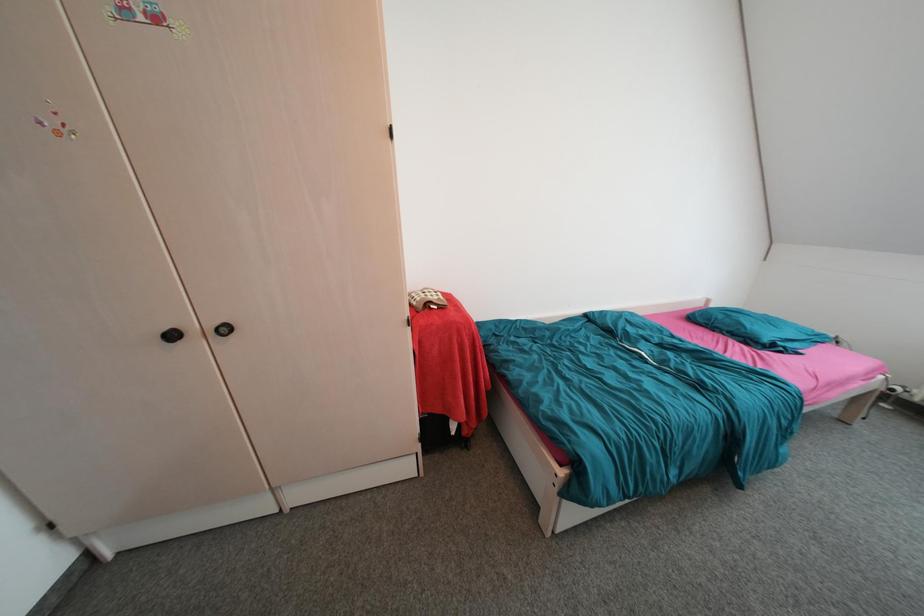
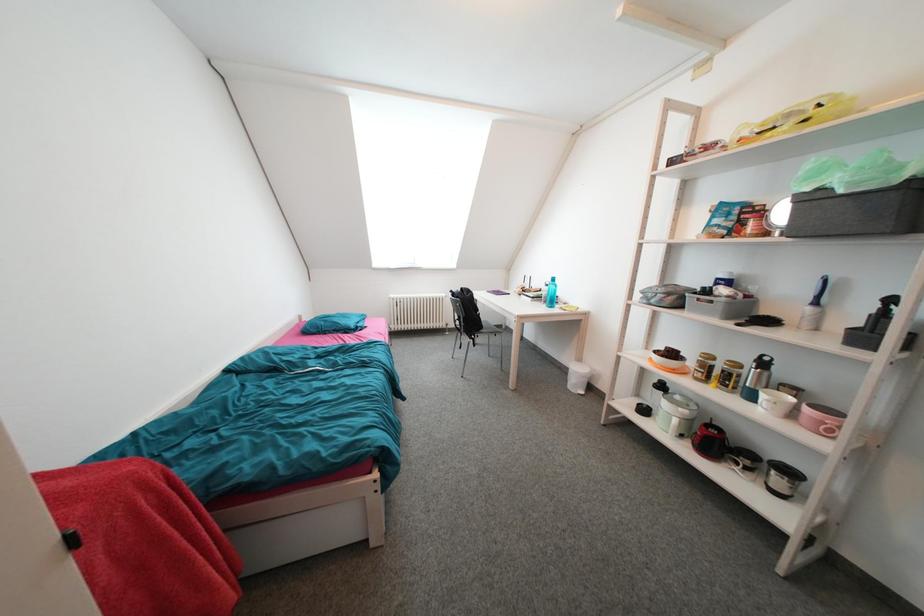
Question: The camera is either moving clockwise (left) or counter-clockwise (right) around the object. The first image is from the beginning of the video and the second image is from the end. Is the camera moving left or right when shooting the video?

Choices:
 (A) Left
 (B) Right

Answer: (A)